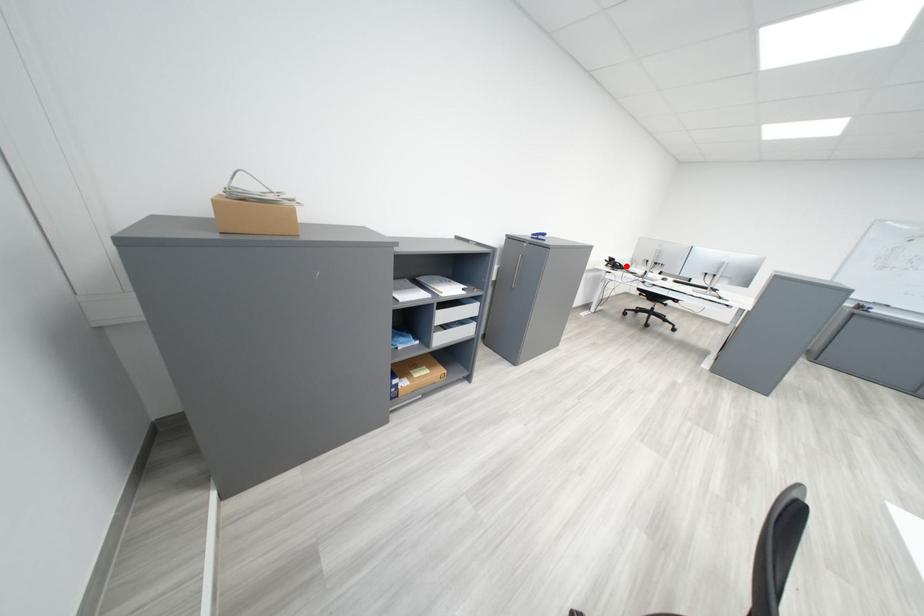
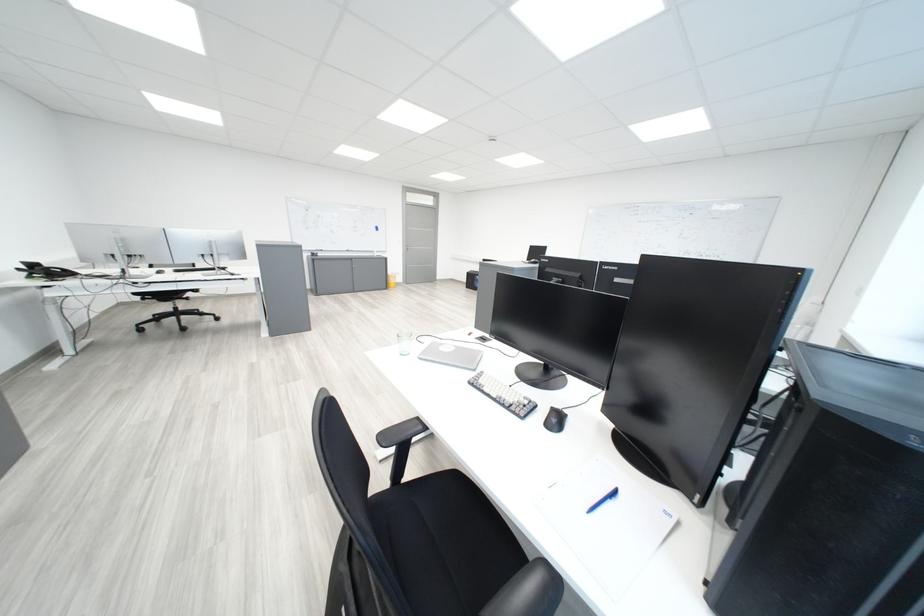
Question: A red point is marked in image1. In image2, is the corresponding 3D point closer to the camera or farther? Reply with the corresponding letter.

Choices:
 (A) The corresponding 3D point is closer.
 (B) The corresponding 3D point is farther.

Answer: (B)